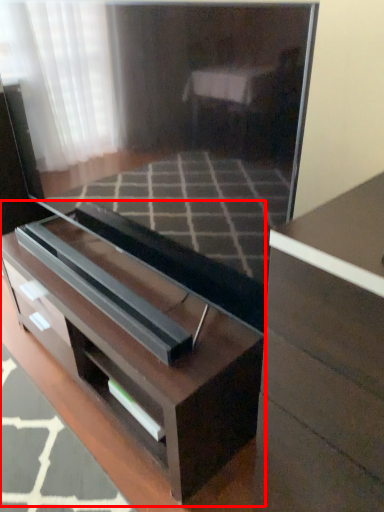
Question: In this image, where is chest of drawers (annotated by the red box) located relative to chest of drawers?

Choices:
 (A) left
 (B) right

Answer: (A)